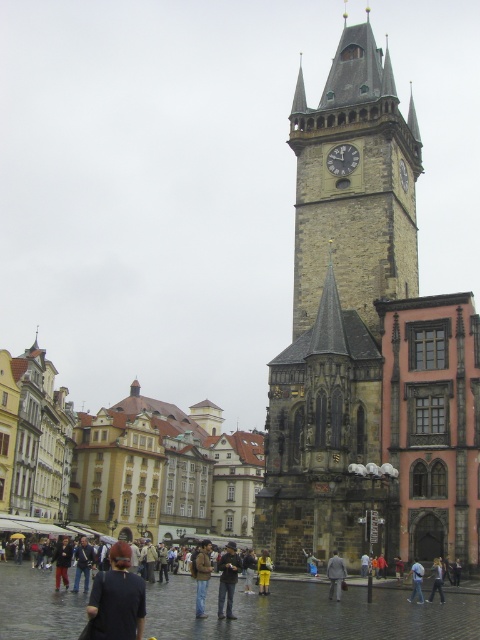
Can you confirm if denim jeans at center is thinner than light gray suit at center?

No, denim jeans at center is not thinner than light gray suit at center.

Which is behind, point (229, 561) or point (338, 598)?

The point (338, 598) is behind.

Is point (222, 612) more distant than point (339, 582)?

No.

I want to click on denim jeans at center, so click(228, 579).

Which is in front, point (232, 582) or point (195, 568)?

Point (232, 582) is in front.

Who is lower down, denim jeans at center or brown leather jacket at center?

denim jeans at center is lower down.

You are a GUI agent. You are given a task and a screenshot of the screen. Output one action in this format:
    pyautogui.click(x=<x>, y=<y>)
    Task: Click on the denim jeans at center
    The image size is (480, 640).
    Given the screenshot: What is the action you would take?
    pyautogui.click(x=228, y=579)

Does matte black jacket at lower left have a greater width compared to light blue jeans at center?

Indeed, matte black jacket at lower left has a greater width compared to light blue jeans at center.

Where is `matte black jacket at lower left`? Image resolution: width=480 pixels, height=640 pixels. matte black jacket at lower left is located at coordinates (61, 563).

Which is in front, point (68, 545) or point (418, 568)?

Positioned in front is point (418, 568).

Locate an element on the screen. Image resolution: width=480 pixels, height=640 pixels. matte black jacket at lower left is located at coordinates (61, 563).